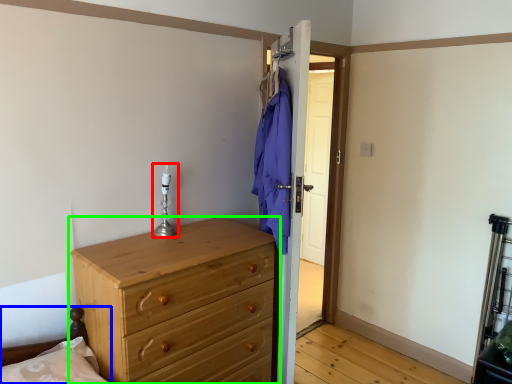
Question: Considering the real-world distances, which object is closest to candle holder (highlighted by a red box)? bed frame (highlighted by a blue box) or chest of drawers (highlighted by a green box).

Choices:
 (A) bed frame
 (B) chest of drawers

Answer: (B)